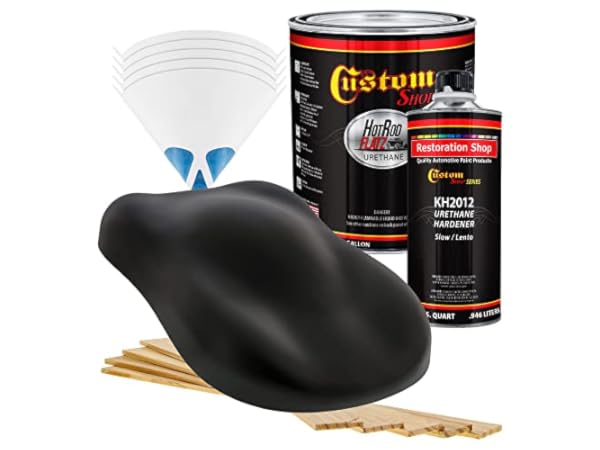
The height and width of the screenshot is (450, 600). Identify the location of wooden stir sticks. (326, 423), (387, 420), (423, 429), (458, 432), (477, 430).